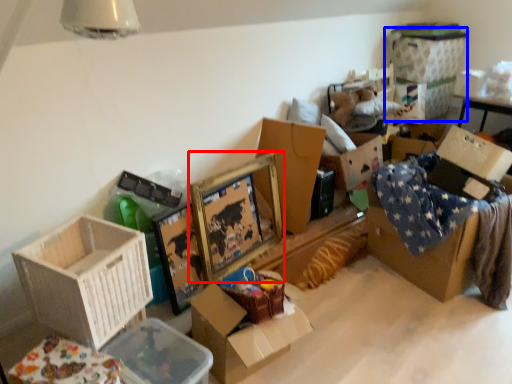
Question: Which object appears closest to the camera in this image, picture frame (highlighted by a red box) or storage box (highlighted by a blue box)?

Choices:
 (A) picture frame
 (B) storage box

Answer: (A)